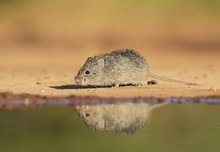
At what (x,y) coordinates should I click in order to perform the action: click on mouse. Please return your answer as a coordinate pair (x, y). The height and width of the screenshot is (152, 220). Looking at the image, I should click on (105, 74).